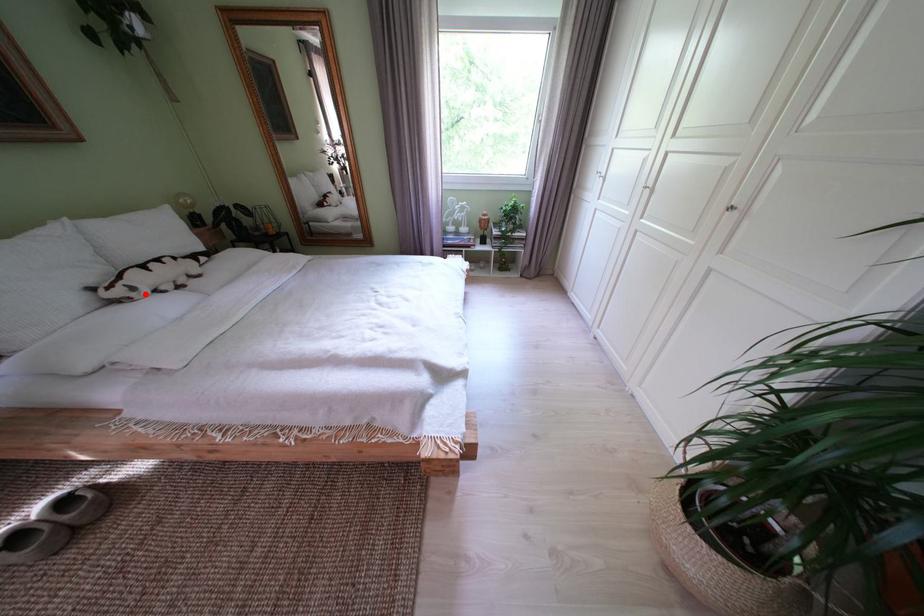
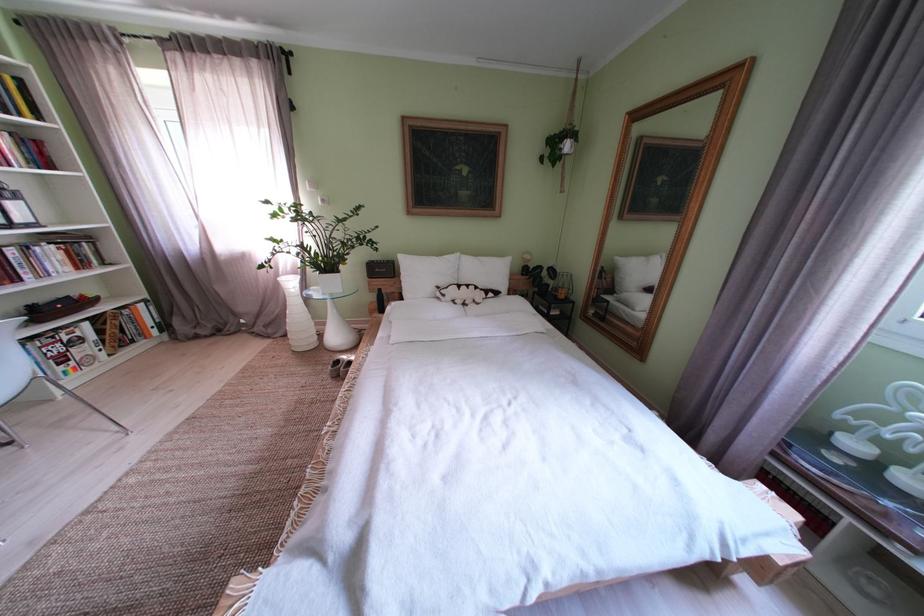
Question: I am providing you with two images of the same scene from different viewpoints. In image1, a red point is highlighted. Considering the same 3D point in image2, which of the following is correct?

Choices:
 (A) It is closer
 (B) It is farther

Answer: (A)